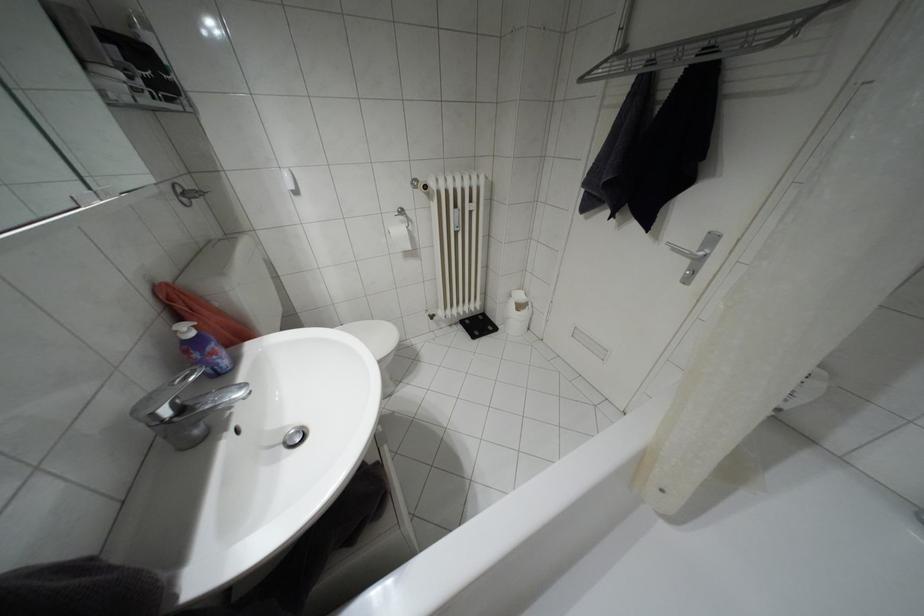
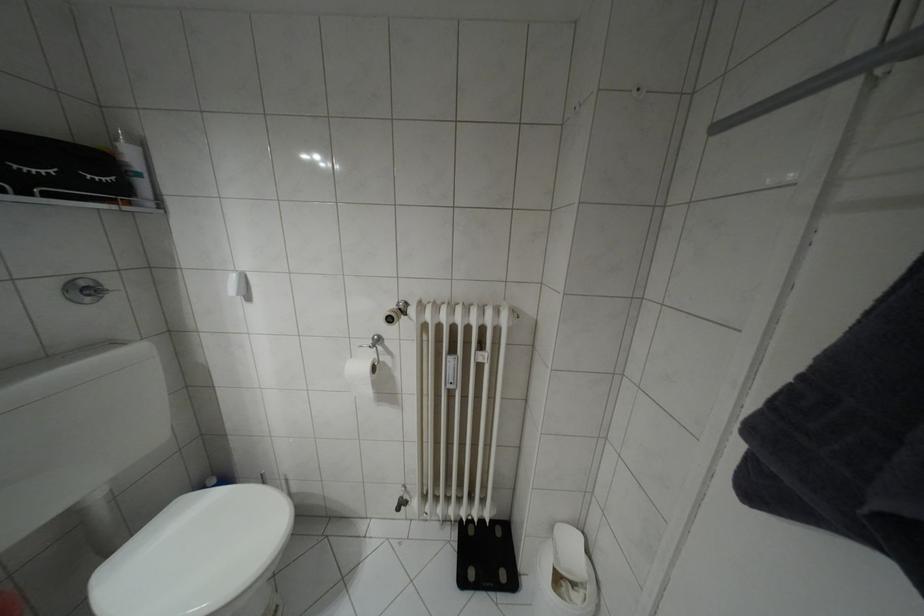
Find the pixel in the second image that matches point 407,246 in the first image.

(369, 392)